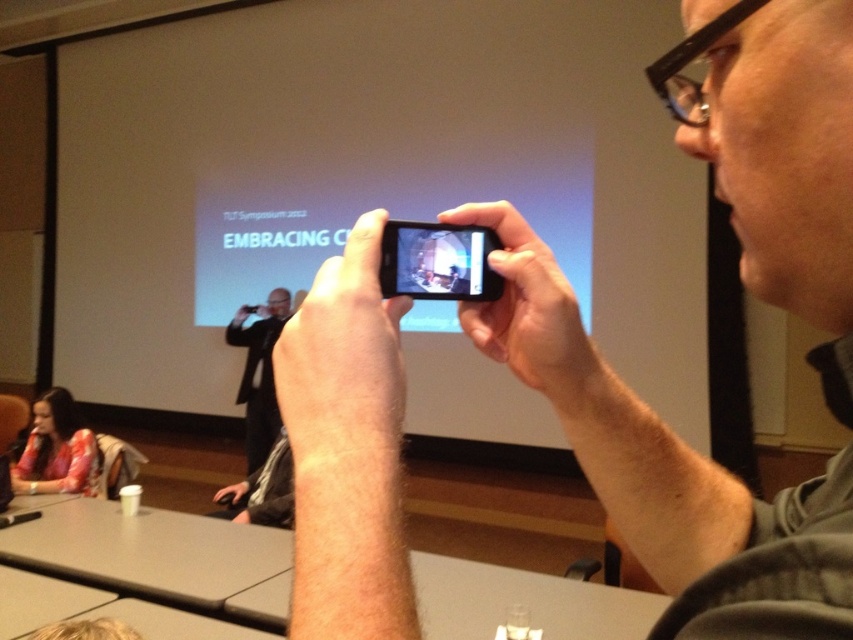
You are attending a presentation and want to take a photo of the screen. You have a black matte phone at center and a dark gray suit at center. Which object is closer to you?

The black matte phone at center is positioned over the dark gray suit at center, so it is closer to you.

You are a photographer trying to capture a clear image of the presentation screen. You have a black matte phone at center and a dark gray suit at center in your viewfinder. Which object should you move to the left to get a better shot of the screen?

The black matte phone at center is positioned on the right side of dark gray suit at center. To get a better shot of the screen, you should move the black matte phone at center to the left so it doesn not block the view of the screen.